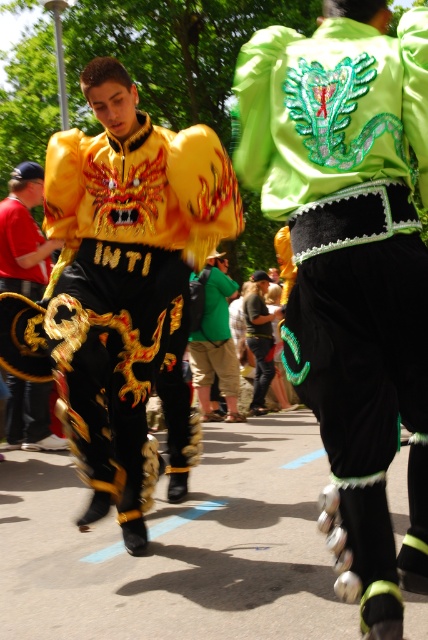
Consider the image. Between green fabric backpack at center and green textured jacket at center, which one appears on the left side from the viewer's perspective?

green fabric backpack at center

Who is more forward, (x=202, y=282) or (x=270, y=353)?

Point (x=202, y=282)

Find the location of a particular element. green fabric backpack at center is located at coordinates (214, 337).

Does matte black dragon costume at left appear under green textured jacket at center?

Actually, matte black dragon costume at left is above green textured jacket at center.

Looking at this image, can you confirm if matte black dragon costume at left is positioned above green textured jacket at center?

Yes.

At what (x,y) coordinates should I click in order to perform the action: click on matte black dragon costume at left. Please return your answer as a coordinate pair (x, y). This screenshot has width=428, height=640. Looking at the image, I should click on (23, 234).

Can you confirm if green sequined dragon at center is thinner than green fabric backpack at center?

Yes, green sequined dragon at center is thinner than green fabric backpack at center.

Is green sequined dragon at center above green fabric backpack at center?

Correct, green sequined dragon at center is located above green fabric backpack at center.

The height and width of the screenshot is (640, 428). What do you see at coordinates (350, 260) in the screenshot?
I see `green sequined dragon at center` at bounding box center [350, 260].

Find the location of a particular element. This screenshot has width=428, height=640. green sequined dragon at center is located at coordinates (350, 260).